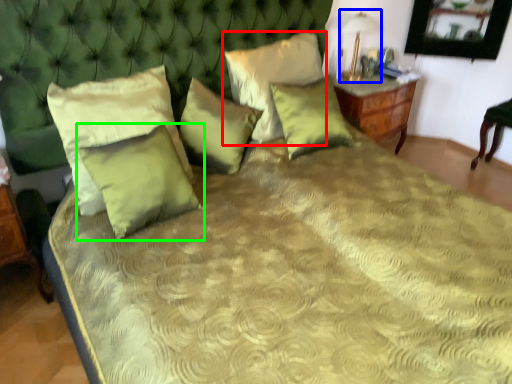
Question: Considering the real-world distances, which object is farthest from pillow (highlighted by a red box)? table lamp (highlighted by a blue box) or pillow (highlighted by a green box)?

Choices:
 (A) table lamp
 (B) pillow

Answer: (B)